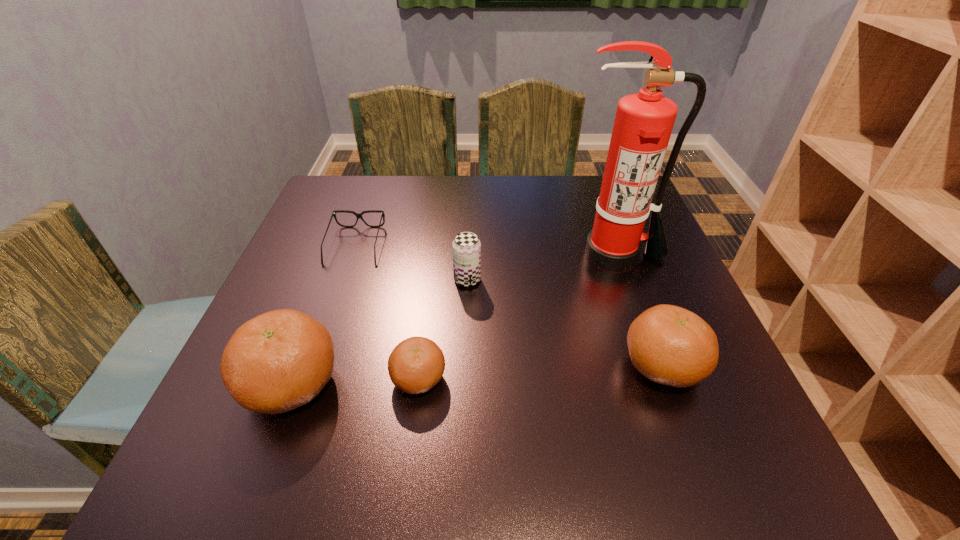
Where is `vacant point that satisfies the following two spatial constraints: 1. on the back side of the leftmost clementine; 2. on the right side of the second clementine from right to left`? This screenshot has height=540, width=960. vacant point that satisfies the following two spatial constraints: 1. on the back side of the leftmost clementine; 2. on the right side of the second clementine from right to left is located at coordinates (295, 379).

Where is `free space that satisfies the following two spatial constraints: 1. with the lenses facing outward on the rightmost clementine; 2. on the right side of the shortest object`? The image size is (960, 540). free space that satisfies the following two spatial constraints: 1. with the lenses facing outward on the rightmost clementine; 2. on the right side of the shortest object is located at coordinates (315, 367).

Locate an element on the screen. blank space that satisfies the following two spatial constraints: 1. on the back side of the beer can; 2. on the left side of the leftmost clementine is located at coordinates (331, 280).

Locate an element on the screen. vacant space that satisfies the following two spatial constraints: 1. on the front side of the fourth object from left to right; 2. on the left side of the rightmost clementine is located at coordinates (465, 367).

I want to click on free space that satisfies the following two spatial constraints: 1. on the back side of the rightmost clementine; 2. on the left side of the fourth object from right to left, so click(x=420, y=367).